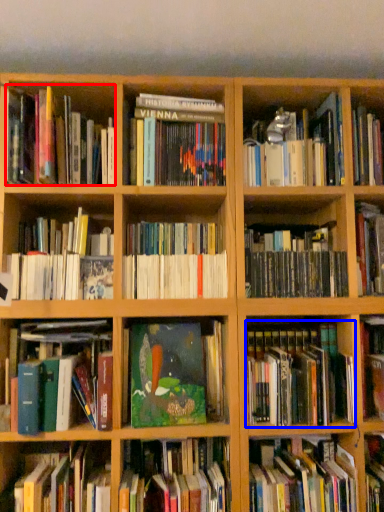
Question: Which object is further to the camera taking this photo, book (highlighted by a red box) or book (highlighted by a blue box)?

Choices:
 (A) book
 (B) book

Answer: (B)